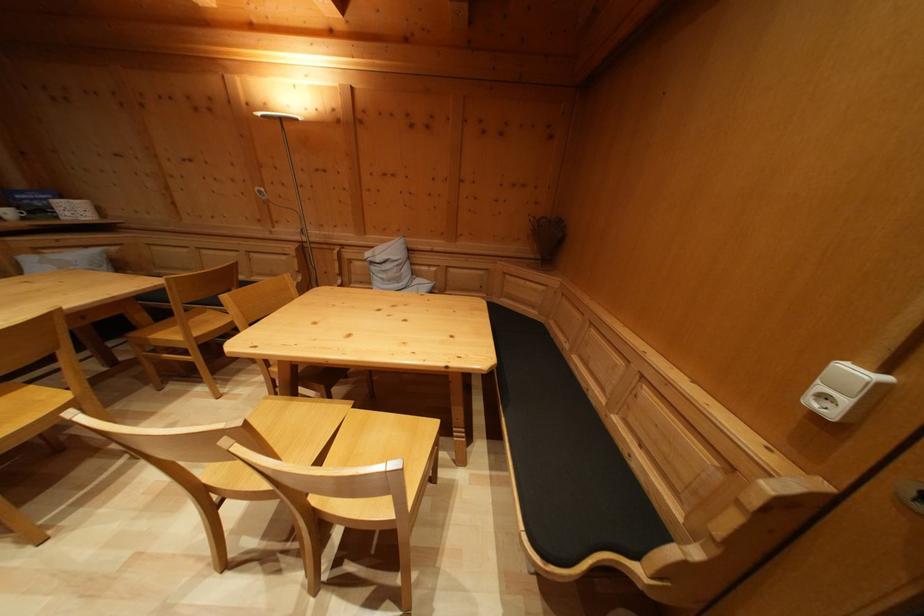
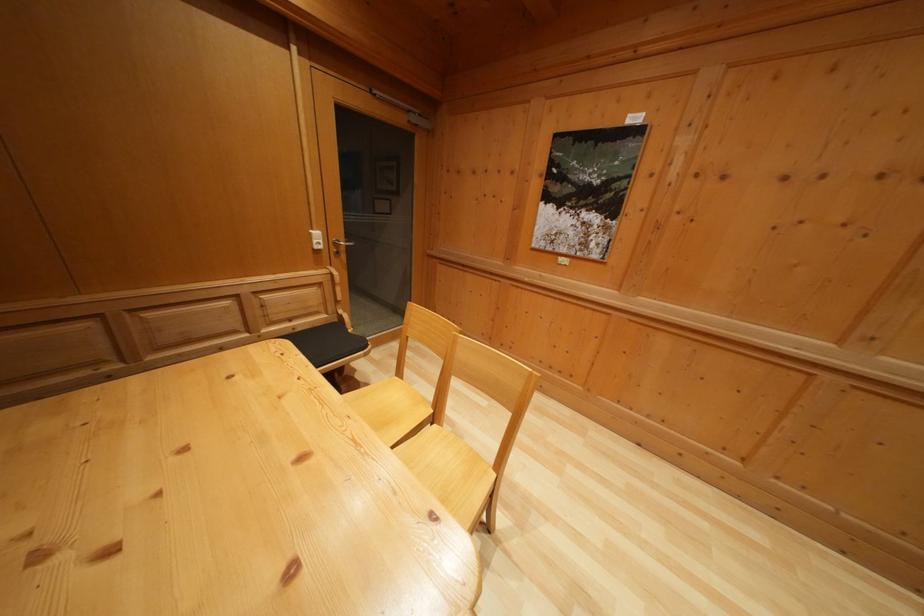
In the second image, find the point that corresponds to point 638,472 in the first image.

(305, 336)